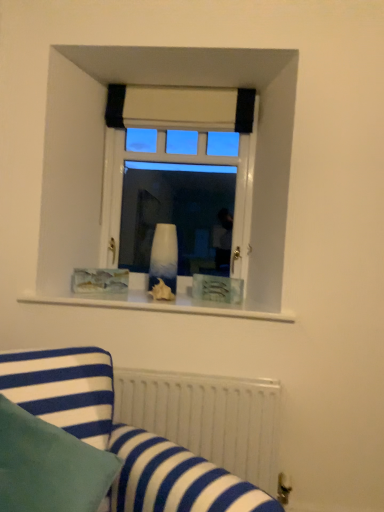
Question: In terms of size, does white matte radiator at lower center appear bigger or smaller than white glossy vase at center?

Choices:
 (A) small
 (B) big

Answer: (B)

Question: Do you think white matte radiator at lower center is within white glossy vase at center, or outside of it?

Choices:
 (A) outside
 (B) inside

Answer: (A)

Question: Which object is the closest to the white matte radiator at lower center?

Choices:
 (A) white glossy vase at center
 (B) blue striped fabric at lower left
 (C) white glossy vase at center

Answer: (B)

Question: Which of these objects is positioned closest to the blue striped fabric at lower left?

Choices:
 (A) white glossy vase at center
 (B) white matte radiator at lower center
 (C) white glossy vase at center

Answer: (B)